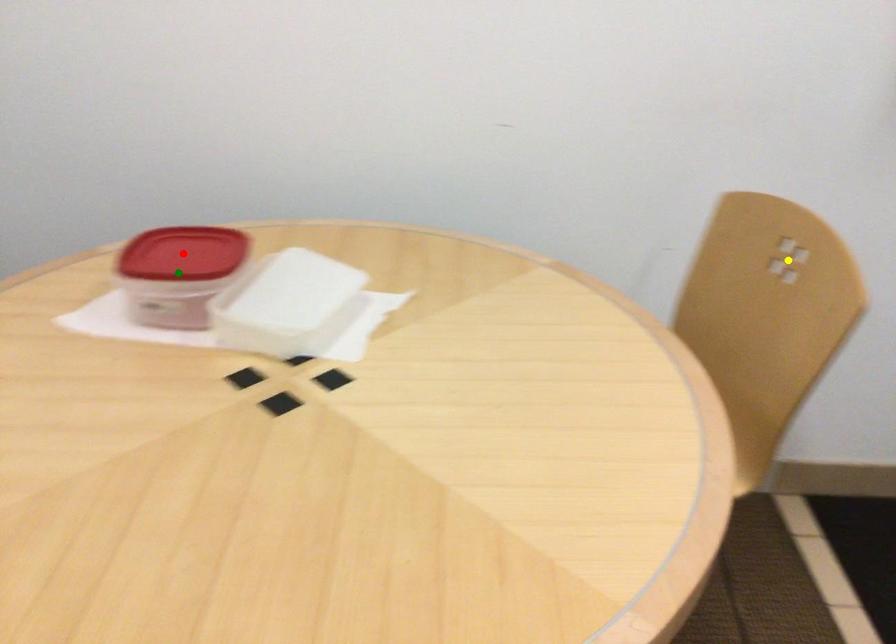
Order these from nearest to farthest:
- yellow point
- red point
- green point

green point
red point
yellow point